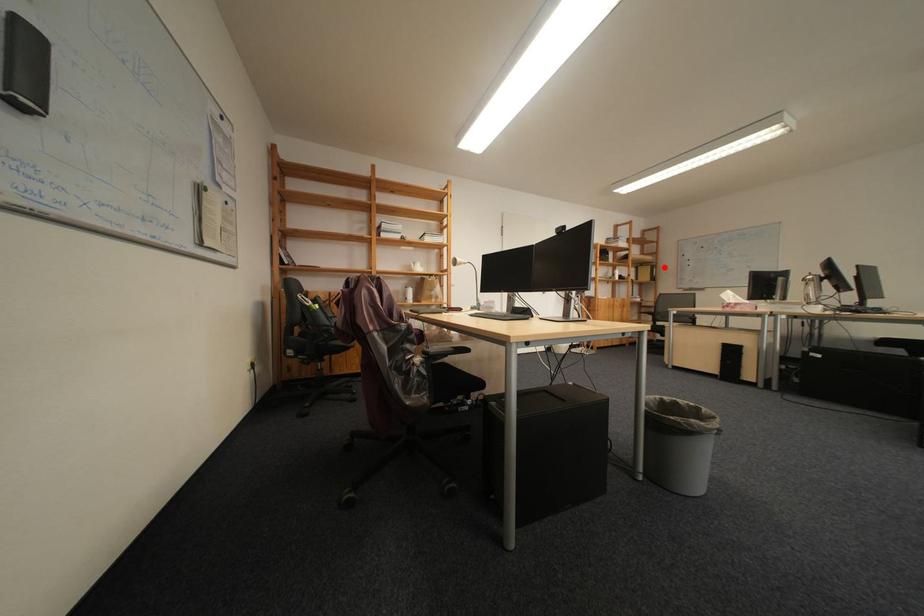
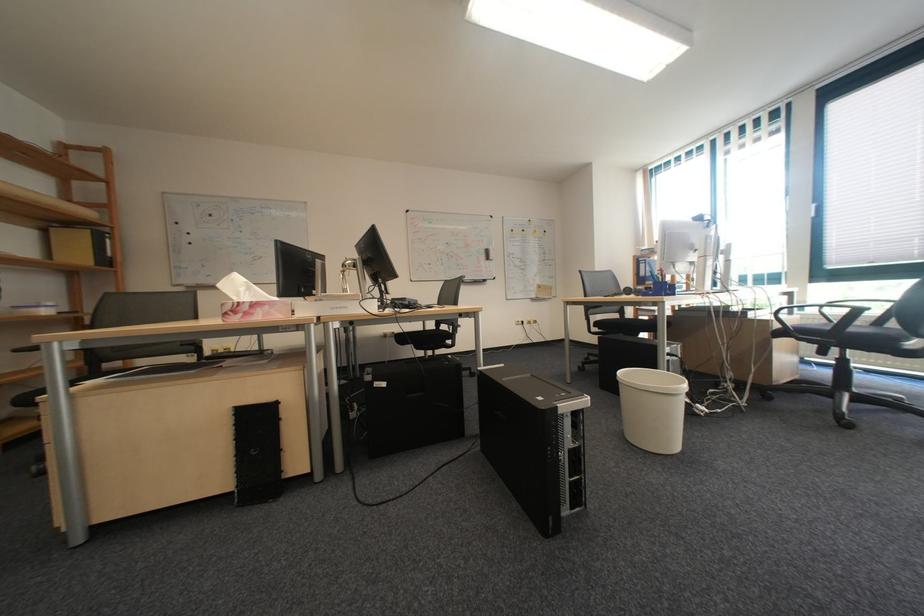
Where in the second image is the point corresponding to the highlighted location from the first image?

(103, 232)